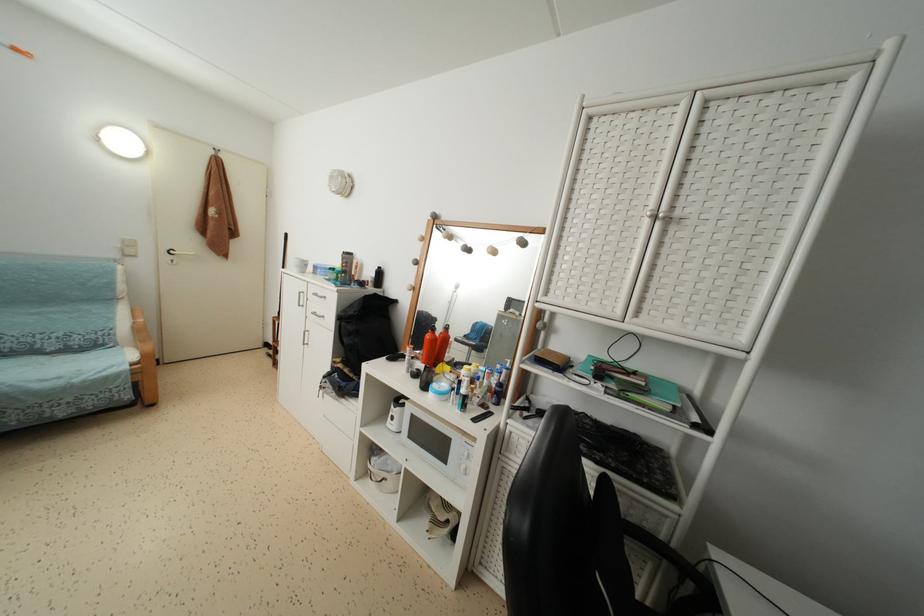
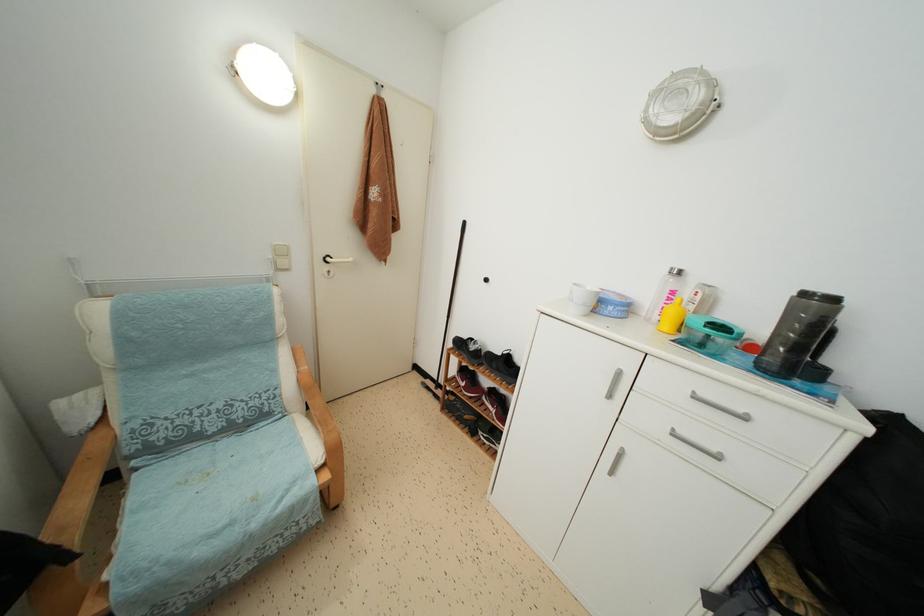
Find the pixel in the second image that matches pixel 320 300 in the first image.

(699, 402)